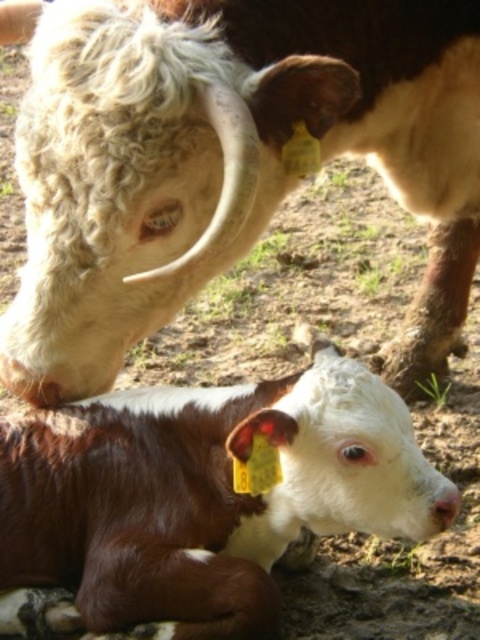
In the scene shown: Can you confirm if white woolen head at upper left is positioned to the right of brown glossy calf at lower left?

Indeed, white woolen head at upper left is positioned on the right side of brown glossy calf at lower left.

Is white woolen head at upper left taller than brown glossy calf at lower left?

Indeed, white woolen head at upper left has a greater height compared to brown glossy calf at lower left.

Does point (98, 349) come farther from viewer compared to point (184, 433)?

No, (98, 349) is in front of (184, 433).

Where is `white woolen head at upper left`? The image size is (480, 640). white woolen head at upper left is located at coordinates (227, 163).